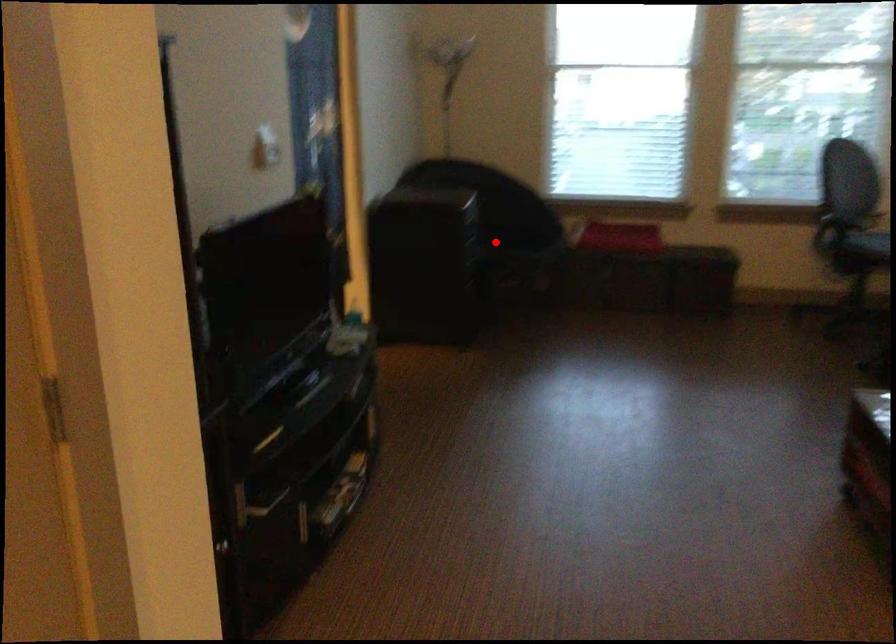
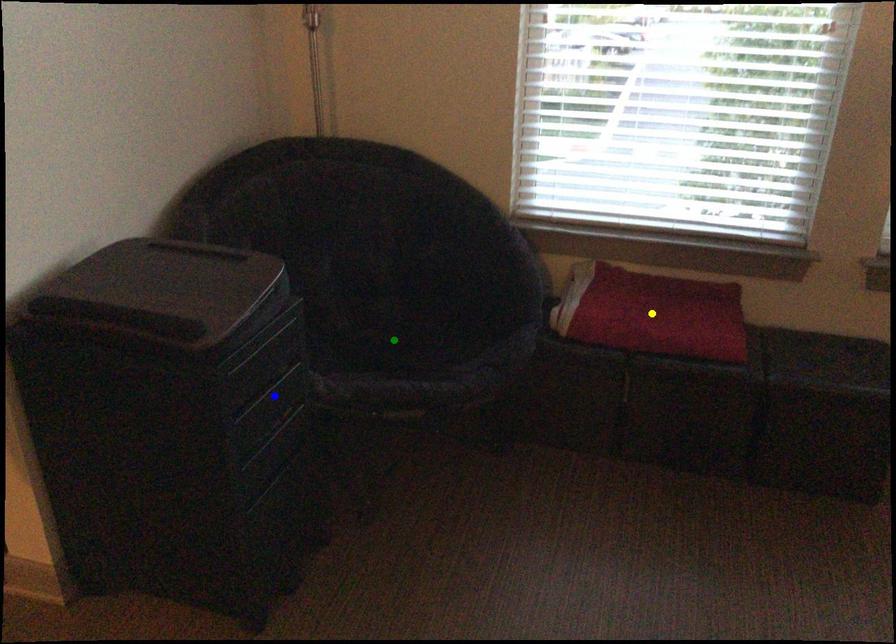
Question: I am providing you with two images of the same scene from different viewpoints. A red point is marked on the first image. You are given multiple points on the second image. Can you choose the point in image 2 that corresponds to the point in image 1?

Choices:
 (A) green point
 (B) yellow point
 (C) blue point

Answer: (A)